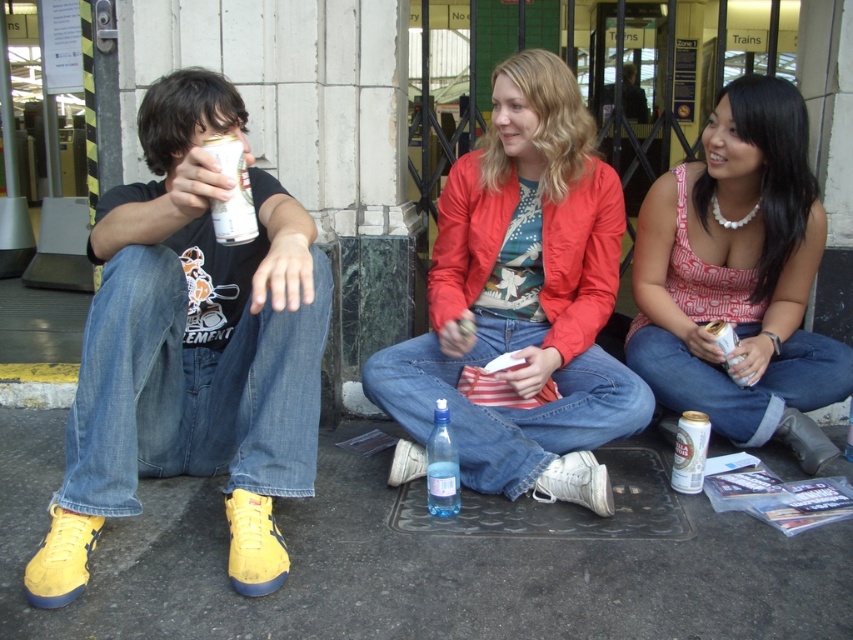
Can you confirm if smooth concrete pavement at lower center is thinner than silver metallic can at left?

No, smooth concrete pavement at lower center is not thinner than silver metallic can at left.

This screenshot has height=640, width=853. In order to click on smooth concrete pavement at lower center in this screenshot , I will do `click(405, 564)`.

Which is in front, point (132, 540) or point (225, 240)?

Point (225, 240) is in front.

Locate an element on the screen. This screenshot has height=640, width=853. smooth concrete pavement at lower center is located at coordinates (405, 564).

Can you confirm if smooth concrete pavement at lower center is positioned to the left of matte red jacket at center?

Yes, smooth concrete pavement at lower center is to the left of matte red jacket at center.

Who is more forward, (57, 454) or (512, 280)?

Point (57, 454) is in front.

Does point (827, 620) come behind point (457, 225)?

No, it is not.

You are a GUI agent. You are given a task and a screenshot of the screen. Output one action in this format:
    pyautogui.click(x=<x>, y=<y>)
    Task: Click on the smooth concrete pavement at lower center
    The image size is (853, 640).
    Given the screenshot: What is the action you would take?
    pyautogui.click(x=405, y=564)

The image size is (853, 640). What do you see at coordinates (405, 564) in the screenshot? I see `smooth concrete pavement at lower center` at bounding box center [405, 564].

Describe the element at coordinates (405, 564) in the screenshot. The width and height of the screenshot is (853, 640). I see `smooth concrete pavement at lower center` at that location.

Identify the location of smooth concrete pavement at lower center. (405, 564).